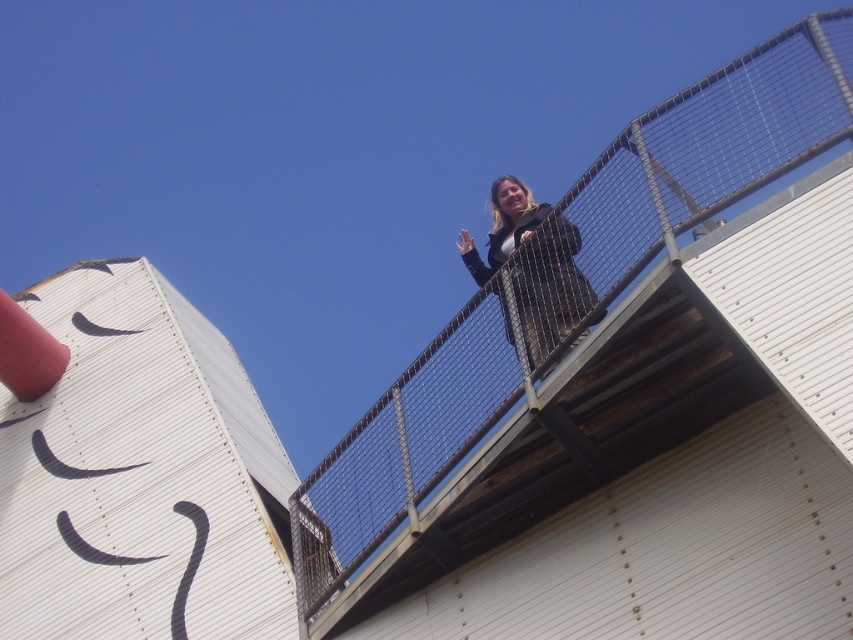
Question: Which of the following is the closest to the observer?

Choices:
 (A) (833, 122)
 (B) (563, 264)

Answer: (A)

Question: Which point appears closest to the camera in this image?

Choices:
 (A) (538, 291)
 (B) (366, 456)

Answer: (A)

Question: Is metal mesh railing at upper center positioned before matte black jacket at upper center?

Choices:
 (A) no
 (B) yes

Answer: (B)

Question: Does metal mesh railing at upper center appear over matte black jacket at upper center?

Choices:
 (A) yes
 (B) no

Answer: (B)

Question: Is metal mesh railing at upper center wider than matte black jacket at upper center?

Choices:
 (A) no
 (B) yes

Answer: (B)